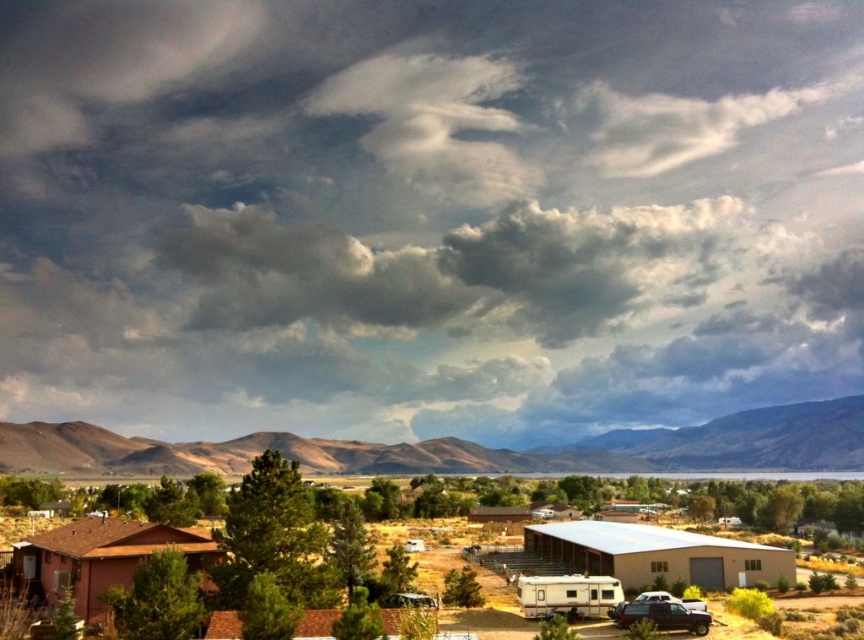
You are planning to park your vehicle in this area and need to know which vehicle takes up more space. Based on the scene, which vehicle between the shiny black suv at lower right and the white plastic trailer at center has a greater width?

The shiny black suv at lower right has a greater width than the white plastic trailer at center according to the description.

You are an architect designing a new solar panel installation. You need to ensure optimal sunlight exposure. Given the position of the cloudy sky at upper center, where would you place the solar panels to avoid shading from the clouds?

The cloudy sky at upper center is located at point (427,212), so the solar panels should be positioned away from this area to avoid shading caused by the clouds.

You are standing in the residential area and want to take a photo of the cloudy sky at upper center and the metallic silver car at center. Which object will appear closer to the camera in your photo?

The cloudy sky at upper center appears closer to the camera because it is further to the viewer than the metallic silver car at center.